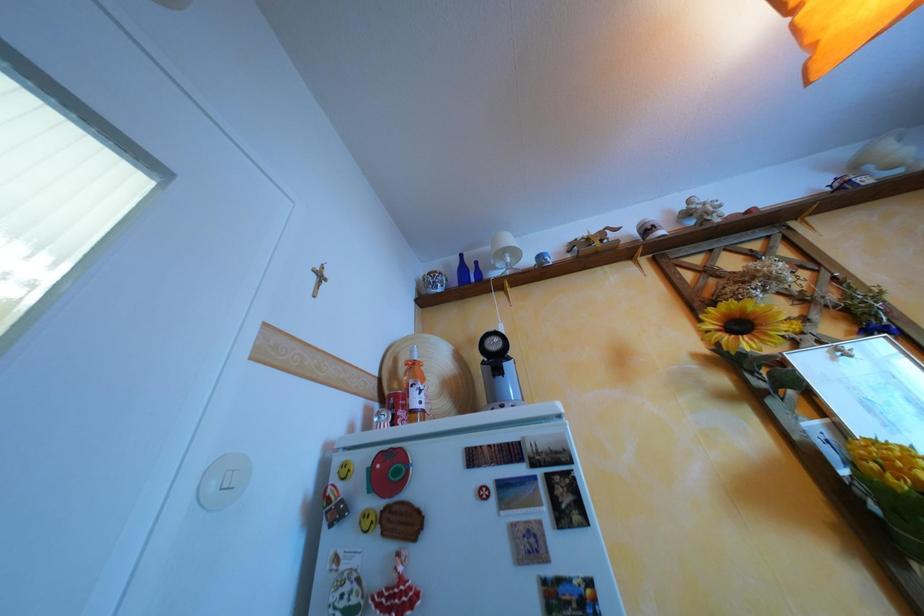
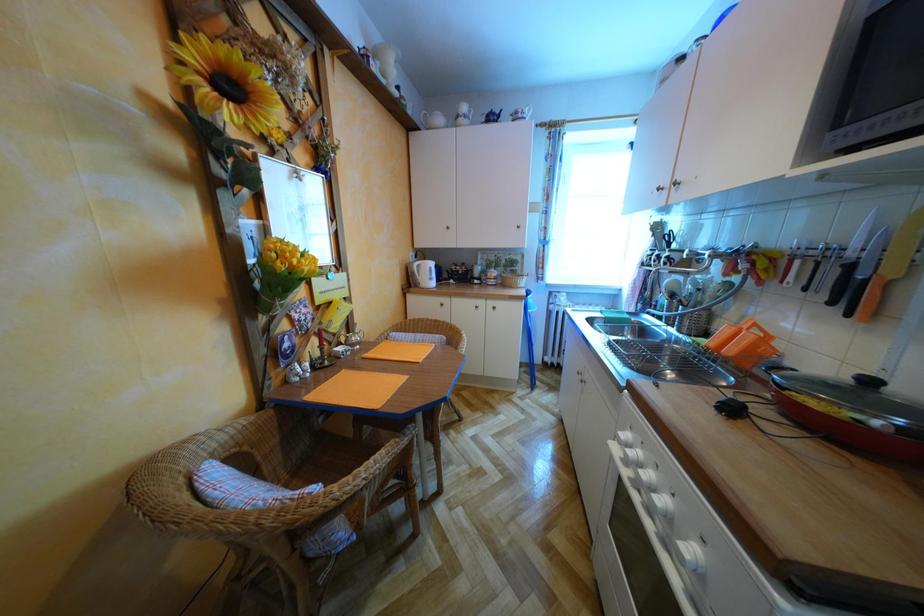
Question: Based on the continuous images, in which direction is the camera rotating? Reply with the corresponding letter.

Choices:
 (A) Left
 (B) Right
 (C) Up
 (D) Down

Answer: (B)